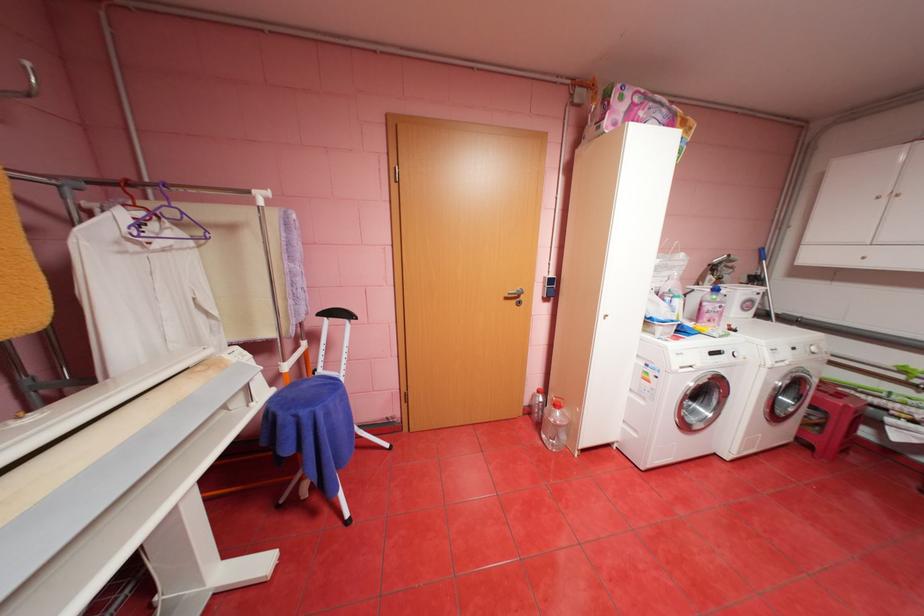
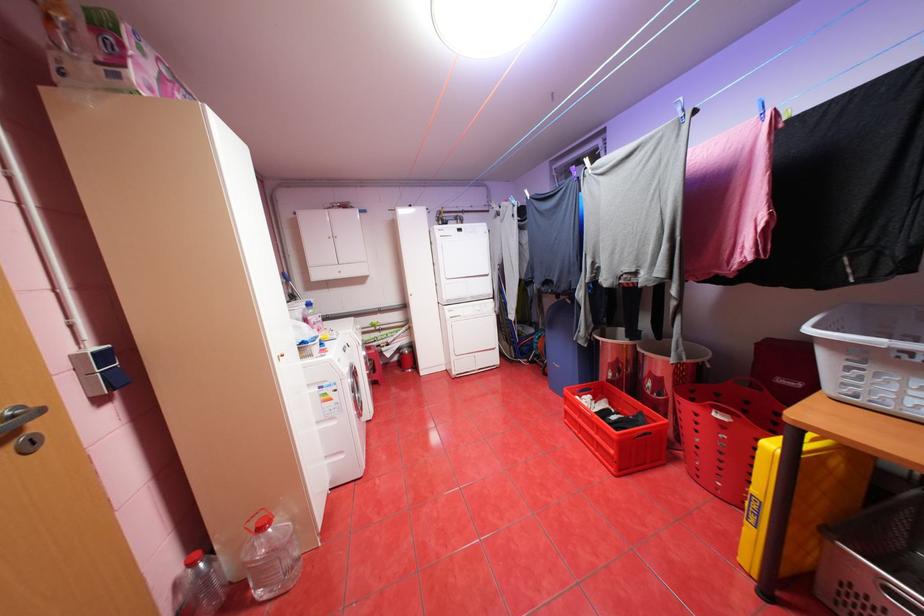
Question: Based on the continuous images, in which direction is the camera rotating? Reply with the corresponding letter.

Choices:
 (A) Left
 (B) Right
 (C) Up
 (D) Down

Answer: (B)